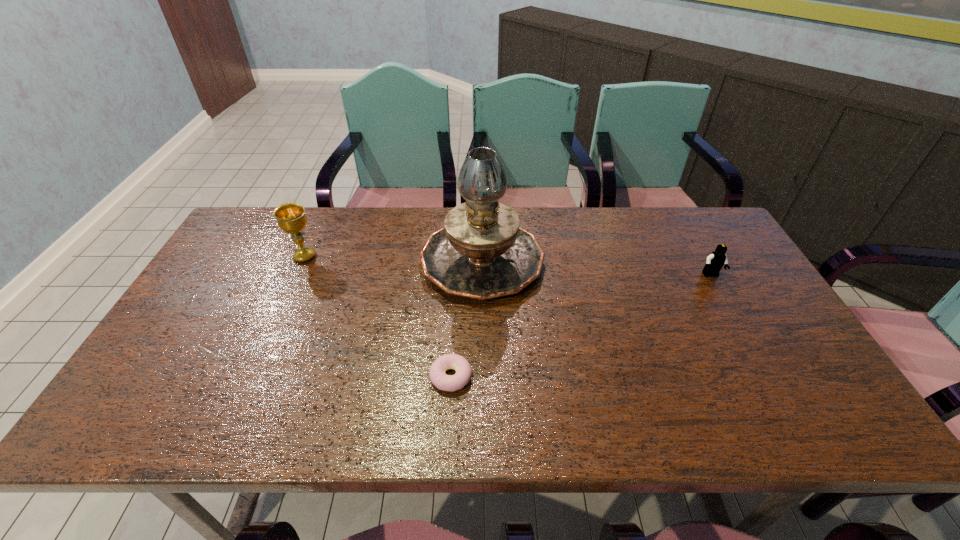
Locate an element on the screen. blank area located on the left of the doughnut is located at coordinates (392, 376).

Image resolution: width=960 pixels, height=540 pixels. I want to click on oil lamp at the far edge, so click(x=481, y=252).

I want to click on chalice that is at the far edge, so click(291, 218).

This screenshot has height=540, width=960. In order to click on object that is at the right edge in this screenshot , I will do `click(715, 261)`.

Locate an element on the screen. free space at the far edge of the desktop is located at coordinates (343, 207).

Locate an element on the screen. This screenshot has height=540, width=960. vacant area at the near edge is located at coordinates (462, 411).

Locate an element on the screen. This screenshot has width=960, height=540. free location at the left edge of the desktop is located at coordinates (206, 338).

Find the location of `vacant space at the right edge of the desktop`. vacant space at the right edge of the desktop is located at coordinates (827, 397).

The image size is (960, 540). In the image, there is a desktop. Identify the location of free space at the near left corner. (172, 418).

Find the location of a particular element. free space at the near right corner is located at coordinates (826, 418).